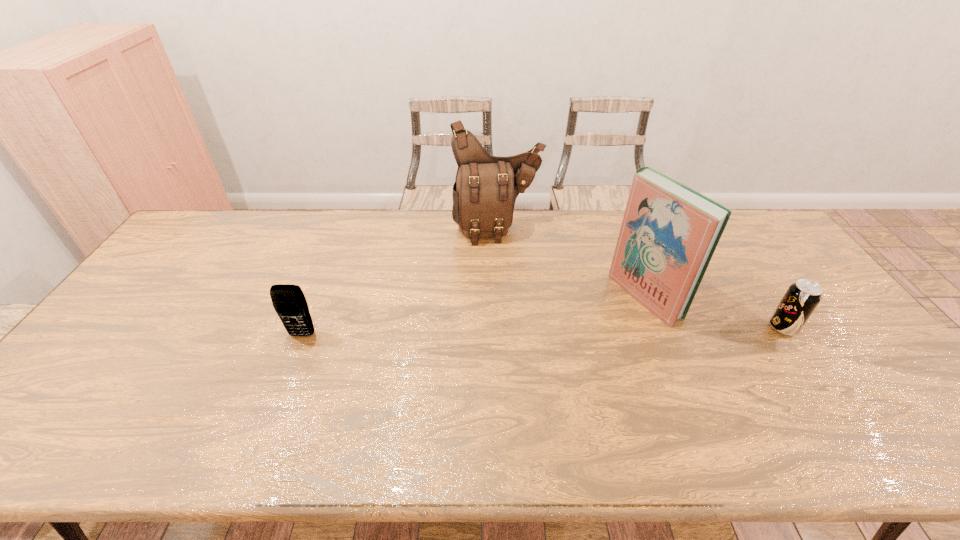
Identify the location of cellular telephone. (289, 302).

Image resolution: width=960 pixels, height=540 pixels. In order to click on the rightmost object in this screenshot , I will do `click(802, 297)`.

Where is `soda can`? This screenshot has width=960, height=540. soda can is located at coordinates (802, 297).

Identify the location of shoulder bag. Image resolution: width=960 pixels, height=540 pixels. (486, 187).

Identify the location of the farthest object. (486, 187).

Locate an element on the screen. The height and width of the screenshot is (540, 960). the second object from right to left is located at coordinates (669, 232).

This screenshot has height=540, width=960. I want to click on free region located on the screen of the cellular telephone, so click(281, 388).

Where is `free space located 0.090m on the left of the rightmost object`? free space located 0.090m on the left of the rightmost object is located at coordinates (736, 327).

The image size is (960, 540). I want to click on free region located 0.350m on the front-facing side of the shoulder bag, so click(531, 323).

Image resolution: width=960 pixels, height=540 pixels. In order to click on vacant space positioned 0.190m on the front-facing side of the shoulder bag in this screenshot , I will do [x=518, y=285].